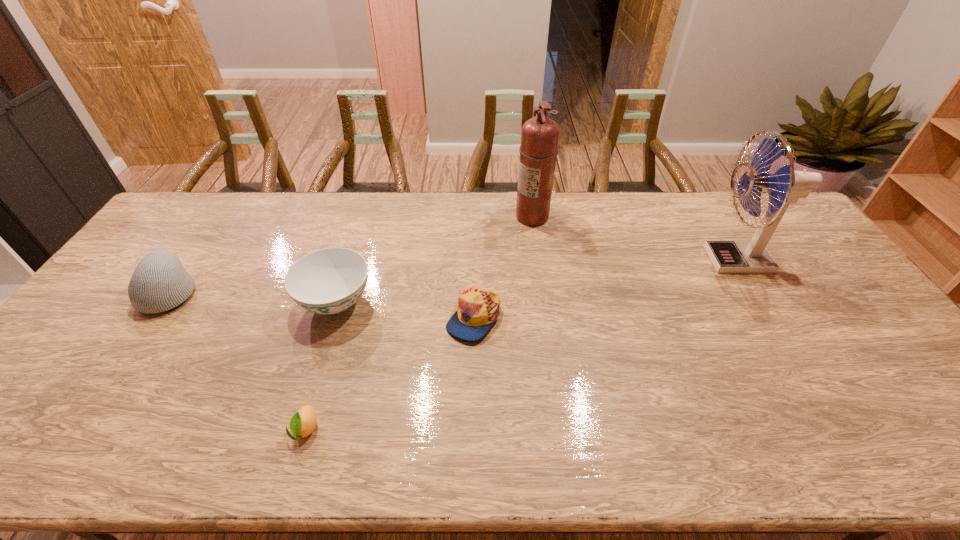
You are a GUI agent. You are given a task and a screenshot of the screen. Output one action in this format:
    pyautogui.click(x=<x>, y=<y>)
    Task: Click on the unoccupied position between the leftmost object and the chinaware
    This screenshot has height=540, width=960.
    Given the screenshot: What is the action you would take?
    pyautogui.click(x=253, y=296)

Identify the location of free space between the cap and the fifth object from left to right. (503, 267).

Locate an element on the screen. The width and height of the screenshot is (960, 540). unoccupied area between the chinaware and the beanie is located at coordinates pyautogui.click(x=253, y=296).

Locate which object is the second closest to the fan. Please provide its 2D coordinates. Your answer should be formatted as a tuple, i.e. [(x, y)], where the tuple contains the x and y coordinates of a point satisfying the conditions above.

[(478, 308)]

Find the location of a particular element. The width and height of the screenshot is (960, 540). object that is the nearest to the second shortest object is located at coordinates (328, 281).

The image size is (960, 540). What are the coordinates of `free point that satisfies the following two spatial constraints: 1. on the front side of the chinaware; 2. on the right side of the beanie` in the screenshot? It's located at (163, 302).

I want to click on vacant space that satisfies the following two spatial constraints: 1. on the front-facing side of the rightmost object; 2. with leaves positioned above the lemon, so click(x=838, y=429).

The width and height of the screenshot is (960, 540). In order to click on vacant area that satisfies the following two spatial constraints: 1. on the front-facing side of the fan; 2. with leaves positioned above the nearest object in this screenshot , I will do `click(838, 429)`.